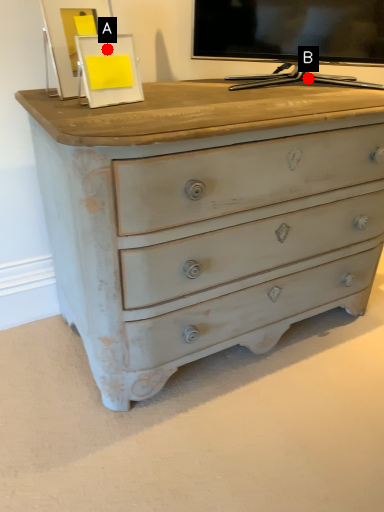
Question: Two points are circled on the image, labeled by A and B beside each circle. Which point appears farthest from the camera in this image?

Choices:
 (A) A is further
 (B) B is further

Answer: (B)